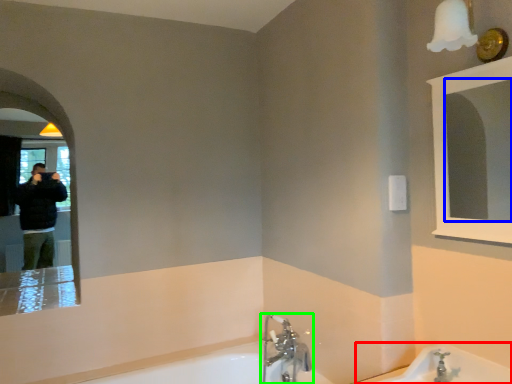
Question: Which is nearer to the bath (highlighted by a red box)? mirror (highlighted by a blue box) or tap (highlighted by a green box).

Choices:
 (A) mirror
 (B) tap

Answer: (B)